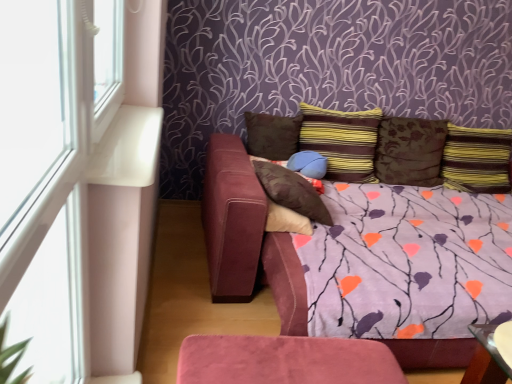
The image size is (512, 384). Find the location of `transparent glass table at lower right`. transparent glass table at lower right is located at coordinates (486, 359).

What is the approximate width of velvet brown pillow at center, the second pillow in the left-to-right sequence?

The width of velvet brown pillow at center, the second pillow in the left-to-right sequence, is 17.52 inches.

What do you see at coordinates (342, 141) in the screenshot? This screenshot has height=384, width=512. I see `striped fabric pillow at center, arranged as the third pillow when viewed from the right` at bounding box center [342, 141].

The width and height of the screenshot is (512, 384). Describe the element at coordinates (272, 135) in the screenshot. I see `brown suede pillow at center, which is the first pillow from left to right` at that location.

Find the location of a particular element. The image size is (512, 384). white plastic window frame at left is located at coordinates (75, 181).

Is brown floral pillow at center, placed as the 2th pillow when sorted from right to left, oriented away from suede-like purple couch at center?

No.

How different are the orientations of brown floral pillow at center, acting as the 5th pillow starting from the left, and suede-like purple couch at center in degrees?

There is a 88.1-degree angle between the facing directions of brown floral pillow at center, acting as the 5th pillow starting from the left, and suede-like purple couch at center.

Considering the sizes of objects brown floral pillow at center, placed as the 2th pillow when sorted from right to left, and suede-like purple couch at center in the image provided, who is smaller, brown floral pillow at center, placed as the 2th pillow when sorted from right to left, or suede-like purple couch at center?

Smaller between the two is brown floral pillow at center, placed as the 2th pillow when sorted from right to left.

Measure the distance from brown floral pillow at center, placed as the 2th pillow when sorted from right to left, to suede-like purple couch at center.

The distance of brown floral pillow at center, placed as the 2th pillow when sorted from right to left, from suede-like purple couch at center is 21.20 inches.

Is blue fabric pillow at center, the 3th pillow when ordered from left to right, outside of transparent glass table at lower right?

Absolutely, blue fabric pillow at center, the 3th pillow when ordered from left to right, is external to transparent glass table at lower right.

How different are the orientations of blue fabric pillow at center, the 3th pillow when ordered from left to right, and transparent glass table at lower right in degrees?

blue fabric pillow at center, the 3th pillow when ordered from left to right, and transparent glass table at lower right are facing 0.137 degrees away from each other.

Consider the image. Is blue fabric pillow at center, the 3th pillow when ordered from left to right, oriented towards transparent glass table at lower right?

Yes, blue fabric pillow at center, the 3th pillow when ordered from left to right, faces towards transparent glass table at lower right.

Which is less distant, (309, 154) or (489, 379)?

Positioned in front is point (489, 379).

Considering the relative sizes of blue fabric pillow at center, the 3th pillow when ordered from left to right, and brown suede pillow at center, which is the first pillow from left to right, in the image provided, is blue fabric pillow at center, the 3th pillow when ordered from left to right, shorter than brown suede pillow at center, which is the first pillow from left to right,?

Yes, blue fabric pillow at center, the 3th pillow when ordered from left to right, is shorter than brown suede pillow at center, which is the first pillow from left to right.

In the image, is blue fabric pillow at center, placed as the 4th pillow when sorted from right to left, positioned in front of or behind brown suede pillow at center, the 6th pillow from the right?

Visually, blue fabric pillow at center, placed as the 4th pillow when sorted from right to left, is located in front of brown suede pillow at center, the 6th pillow from the right.

Is blue fabric pillow at center, the 3th pillow when ordered from left to right, to the left of brown suede pillow at center, which is the first pillow from left to right, from the viewer's perspective?

In fact, blue fabric pillow at center, the 3th pillow when ordered from left to right, is to the right of brown suede pillow at center, which is the first pillow from left to right.

From the image's perspective, is blue fabric pillow at center, placed as the 4th pillow when sorted from right to left, positioned above or below brown suede pillow at center, the 6th pillow from the right?

From the image's perspective, blue fabric pillow at center, placed as the 4th pillow when sorted from right to left, appears below brown suede pillow at center, the 6th pillow from the right.

Which object is further away from the camera, brown suede pillow at center, the 6th pillow from the right, or blue fabric pillow at center, the 3th pillow when ordered from left to right?

brown suede pillow at center, the 6th pillow from the right.

From the picture: Is brown suede pillow at center, which is the first pillow from left to right, facing away from blue fabric pillow at center, the 3th pillow when ordered from left to right?

No, brown suede pillow at center, which is the first pillow from left to right, is not facing away from blue fabric pillow at center, the 3th pillow when ordered from left to right.

Does point (291, 153) come closer to viewer compared to point (312, 171)?

No, (291, 153) is further to viewer.

From the image's perspective, between brown suede pillow at center, the 6th pillow from the right, and blue fabric pillow at center, the 3th pillow when ordered from left to right, who is located below?

blue fabric pillow at center, the 3th pillow when ordered from left to right, appears lower in the image.

Between velvet brown pillow at center, acting as the 5th pillow starting from the right, and transparent glass table at lower right, which one has more height?

With more height is velvet brown pillow at center, acting as the 5th pillow starting from the right.

Consider the image. Which object is further away from the camera, velvet brown pillow at center, acting as the 5th pillow starting from the right, or transparent glass table at lower right?

velvet brown pillow at center, acting as the 5th pillow starting from the right, is further away from the camera.

Is velvet brown pillow at center, the second pillow in the left-to-right sequence, positioned far away from transparent glass table at lower right?

No, velvet brown pillow at center, the second pillow in the left-to-right sequence, is in close proximity to transparent glass table at lower right.

Locate an element on the screen. table that is above the velvet brown pillow at center, the second pillow in the left-to-right sequence (from a real-world perspective) is located at coordinates [486, 359].

Looking at their sizes, would you say striped fabric pillow at center, arranged as the third pillow when viewed from the right, is wider or thinner than brown floral pillow at center, acting as the 5th pillow starting from the left?

In the image, striped fabric pillow at center, arranged as the third pillow when viewed from the right, appears to be wider than brown floral pillow at center, acting as the 5th pillow starting from the left.

The height and width of the screenshot is (384, 512). Identify the location of the 2nd pillow behind the striped fabric pillow at center, acting as the 4th pillow starting from the left. (410, 151).

How distant is striped fabric pillow at center, arranged as the third pillow when viewed from the right, from brown floral pillow at center, placed as the 2th pillow when sorted from right to left?

The distance of striped fabric pillow at center, arranged as the third pillow when viewed from the right, from brown floral pillow at center, placed as the 2th pillow when sorted from right to left, is 26.26 centimeters.

Would you say velvet brown pillow at center, the second pillow in the left-to-right sequence, is outside brown floral pillow at center, acting as the 5th pillow starting from the left?

velvet brown pillow at center, the second pillow in the left-to-right sequence, is positioned outside brown floral pillow at center, acting as the 5th pillow starting from the left.

In terms of height, does velvet brown pillow at center, acting as the 5th pillow starting from the right, look taller or shorter compared to brown floral pillow at center, acting as the 5th pillow starting from the left?

Clearly, velvet brown pillow at center, acting as the 5th pillow starting from the right, is shorter compared to brown floral pillow at center, acting as the 5th pillow starting from the left.

Does point (289, 202) come in front of point (419, 148)?

Yes, it is.

Could you tell me if velvet brown pillow at center, acting as the 5th pillow starting from the right, is facing brown floral pillow at center, placed as the 2th pillow when sorted from right to left?

No, velvet brown pillow at center, acting as the 5th pillow starting from the right, is not turned towards brown floral pillow at center, placed as the 2th pillow when sorted from right to left.

Identify the location of studio couch on the left of brown floral pillow at center, acting as the 5th pillow starting from the left. This screenshot has width=512, height=384. (366, 260).

Where is `pillow that is the 1st object above the transparent glass table at lower right (from a real-world perspective)`? The width and height of the screenshot is (512, 384). pillow that is the 1st object above the transparent glass table at lower right (from a real-world perspective) is located at coordinates (308, 164).

Considering their positions, is velvet brown pillow at center, acting as the 5th pillow starting from the right, positioned further to striped fabric pillow at upper right, which is counted as the sixth pillow, starting from the left, than striped fabric pillow at center, acting as the 4th pillow starting from the left?

velvet brown pillow at center, acting as the 5th pillow starting from the right, is positioned further to the anchor striped fabric pillow at upper right, which is counted as the sixth pillow, starting from the left.

Based on their spatial positions, is suede-like purple couch at center or brown suede pillow at center, which is the first pillow from left to right, further from blue fabric pillow at center, the 3th pillow when ordered from left to right?

suede-like purple couch at center is further to blue fabric pillow at center, the 3th pillow when ordered from left to right.

Looking at this image, based on their spatial positions, is suede-like purple couch at center or striped fabric pillow at upper right, which is counted as the sixth pillow, starting from the left, further from velvet brown pillow at center, acting as the 5th pillow starting from the right?

Among the two, striped fabric pillow at upper right, which is counted as the sixth pillow, starting from the left, is located further to velvet brown pillow at center, acting as the 5th pillow starting from the right.

Estimate the real-world distances between objects in this image. Which object is closer to brown floral pillow at center, acting as the 5th pillow starting from the left, blue fabric pillow at center, placed as the 4th pillow when sorted from right to left, or suede-like purple couch at center?

Based on the image, suede-like purple couch at center appears to be nearer to brown floral pillow at center, acting as the 5th pillow starting from the left.

When comparing their distances from suede-like purple couch at center, does velvet brown pillow at center, the second pillow in the left-to-right sequence, or white plastic window frame at left seem further?

Based on the image, white plastic window frame at left appears to be further to suede-like purple couch at center.

Looking at the image, which one is located closer to blue fabric pillow at center, placed as the 4th pillow when sorted from right to left, white plastic window frame at left or brown floral pillow at center, placed as the 2th pillow when sorted from right to left?

Based on the image, brown floral pillow at center, placed as the 2th pillow when sorted from right to left, appears to be nearer to blue fabric pillow at center, placed as the 4th pillow when sorted from right to left.

In the scene shown: From the image, which object appears to be farther from velvet brown pillow at center, the second pillow in the left-to-right sequence, brown floral pillow at center, placed as the 2th pillow when sorted from right to left, or striped fabric pillow at center, acting as the 4th pillow starting from the left?

brown floral pillow at center, placed as the 2th pillow when sorted from right to left, is further to velvet brown pillow at center, the second pillow in the left-to-right sequence.

Based on their spatial positions, is striped fabric pillow at center, acting as the 4th pillow starting from the left, or striped fabric pillow at upper right, marked as the 1th pillow in a right-to-left arrangement, further from brown floral pillow at center, acting as the 5th pillow starting from the left?

Among the two, striped fabric pillow at upper right, marked as the 1th pillow in a right-to-left arrangement, is located further to brown floral pillow at center, acting as the 5th pillow starting from the left.

The height and width of the screenshot is (384, 512). Identify the location of studio couch positioned between transparent glass table at lower right and striped fabric pillow at upper right, marked as the 1th pillow in a right-to-left arrangement, from near to far. (x=366, y=260).

At what (x,y) coordinates should I click in order to perform the action: click on studio couch positioned between white plastic window frame at left and blue fabric pillow at center, the 3th pillow when ordered from left to right, from near to far. Please return your answer as a coordinate pair (x, y). Image resolution: width=512 pixels, height=384 pixels. Looking at the image, I should click on (366, 260).

This screenshot has height=384, width=512. In order to click on studio couch located between white plastic window frame at left and striped fabric pillow at center, arranged as the third pillow when viewed from the right, in the depth direction in this screenshot , I will do `click(366, 260)`.

Image resolution: width=512 pixels, height=384 pixels. Find the location of `studio couch positioned between white plastic window frame at left and velvet brown pillow at center, acting as the 5th pillow starting from the right, from near to far`. studio couch positioned between white plastic window frame at left and velvet brown pillow at center, acting as the 5th pillow starting from the right, from near to far is located at coordinates (366, 260).